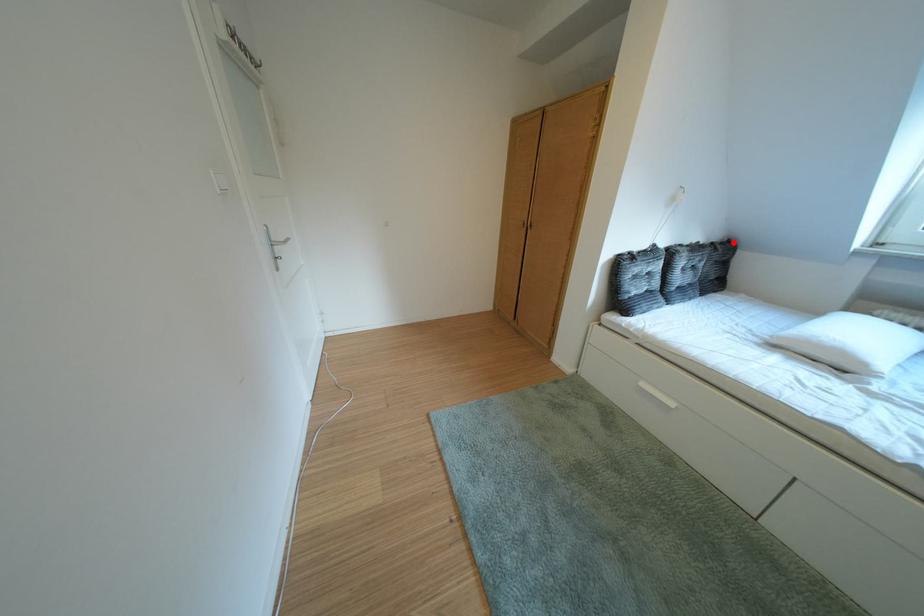
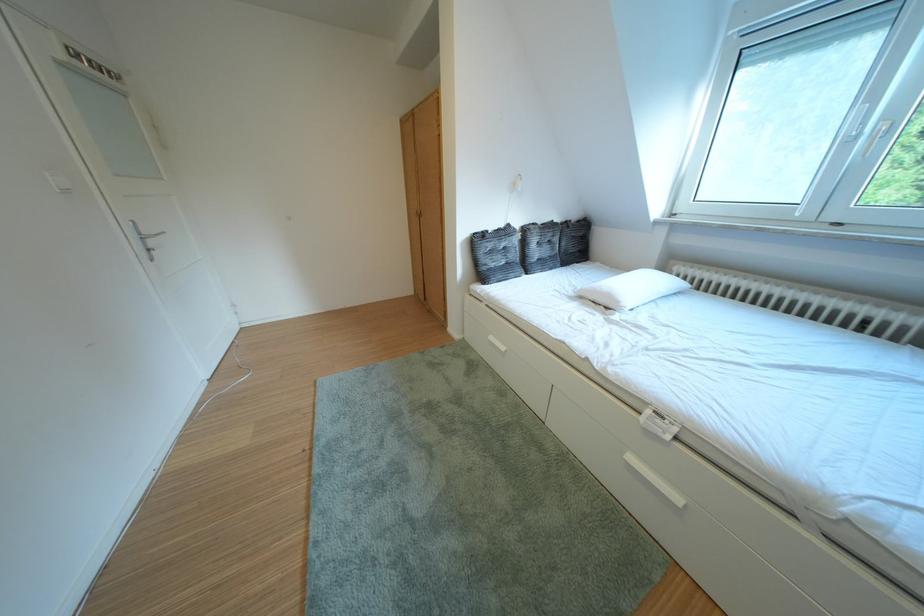
Question: I am providing you with two images of the same scene from different viewpoints. A red point is shown in image1. For the corresponding object point in image2, is it positioned nearer or farther from the camera?

Choices:
 (A) Nearer
 (B) Farther

Answer: (A)